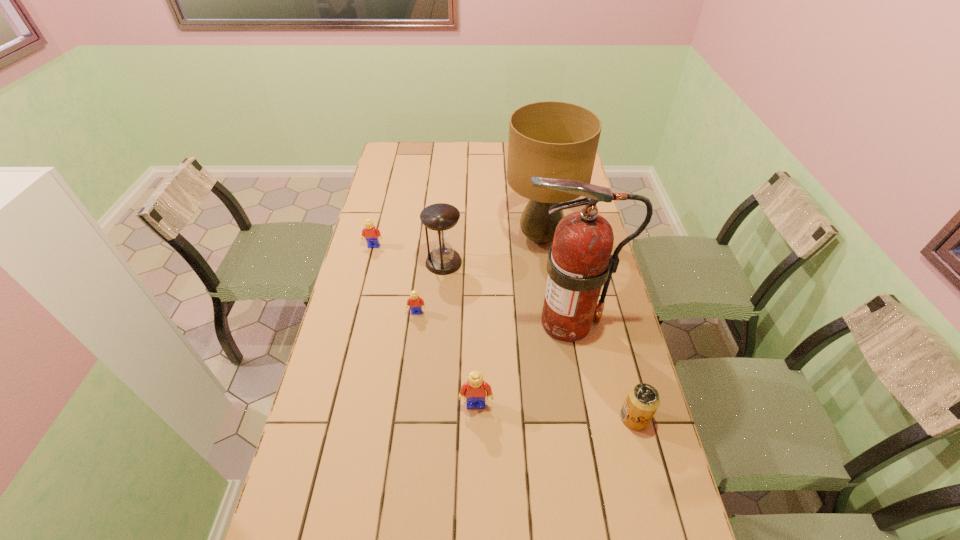
Where is `vacant region located on the front-facing side of the second tallest Lego`? The height and width of the screenshot is (540, 960). vacant region located on the front-facing side of the second tallest Lego is located at coordinates (366, 277).

At what (x,y) coordinates should I click in order to perform the action: click on blank space located on the front-facing side of the shortest Lego. Please return your answer as a coordinate pair (x, y). The height and width of the screenshot is (540, 960). Looking at the image, I should click on pos(411,360).

Find the location of a particular element. Image resolution: width=960 pixels, height=540 pixels. vacant space located 0.180m on the front-facing side of the rightmost Lego is located at coordinates (475, 478).

Where is `vacant space located at the nozzle of the fire extinguisher`? vacant space located at the nozzle of the fire extinguisher is located at coordinates (459, 322).

Locate an element on the screen. free spot located at the nozzle of the fire extinguisher is located at coordinates (419, 322).

At what (x,y) coordinates should I click in order to perform the action: click on vacant space located at the nozzle of the fire extinguisher. Please return your answer as a coordinate pair (x, y). Looking at the image, I should click on (416, 322).

Find the location of a particular element. This screenshot has height=540, width=960. vacant space located 0.190m on the left of the lampshade is located at coordinates (455, 238).

This screenshot has width=960, height=540. What are the coordinates of `vacant space located 0.400m on the front of the hourglass` in the screenshot? It's located at (435, 373).

You are a GUI agent. You are given a task and a screenshot of the screen. Output one action in this format:
    pyautogui.click(x=<x>, y=<y>)
    Task: Click on the vacant area located on the back of the beer can
    This screenshot has width=960, height=540.
    Given the screenshot: What is the action you would take?
    pyautogui.click(x=603, y=296)

The height and width of the screenshot is (540, 960). In order to click on object at the left edge in this screenshot , I will do `click(370, 232)`.